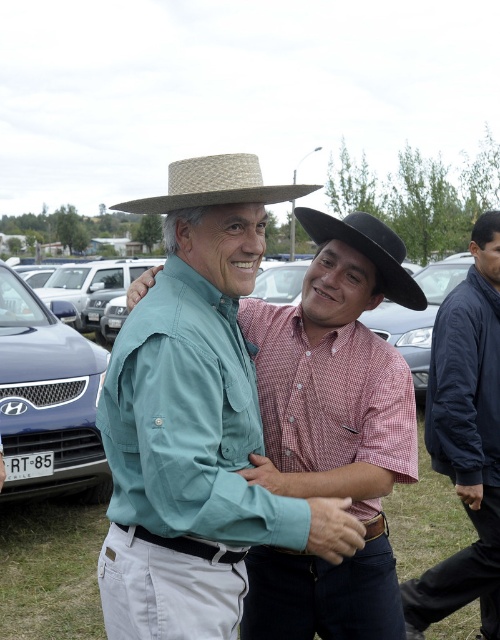
Question: Can you confirm if red checkered shirt at center is positioned above dark blue jacket at right?

Choices:
 (A) no
 (B) yes

Answer: (B)

Question: Which point appears farthest from the camera in this image?

Choices:
 (A) (194, 404)
 (B) (496, 518)

Answer: (B)

Question: Does matte straw hat at center have a smaller size compared to black felt fedora at center?

Choices:
 (A) no
 (B) yes

Answer: (A)

Question: Does dark blue jacket at right appear on the right side of black felt fedora at center?

Choices:
 (A) yes
 (B) no

Answer: (A)

Question: Which object is the closest to the dark blue jacket at right?

Choices:
 (A) matte blue car at left
 (B) natural straw cowboy hat at upper center
 (C) red checkered shirt at center
 (D) matte straw hat at center

Answer: (C)

Question: Which of the following is the farthest from the observer?

Choices:
 (A) natural straw cowboy hat at upper center
 (B) black felt fedora at center
 (C) dark blue jacket at right
 (D) matte straw hat at center

Answer: (C)